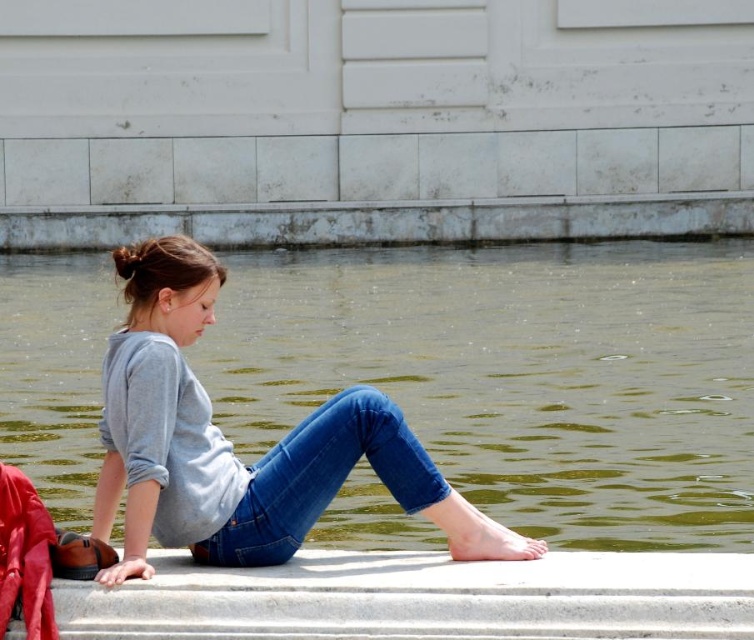
You are a photographer trying to capture a candid shot of the blue denim jeans at lower center without including the gray concrete curb at upper center in the frame. Is this possible based on their positions?

The gray concrete curb at upper center is positioned on the left side of blue denim jeans at lower center. Since the curb is to the left of the jeans, you can adjust your camera angle to the right side of the jeans to exclude the curb from the frame.

You are a fashion designer observing the woman in the scene. You need to measure the distance between her clothing items to ensure proper fit. How far apart are the gray cotton shirt at center and the blue denim jeans at lower center?

The gray cotton shirt at center is 53.02 centimeters from blue denim jeans at lower center.